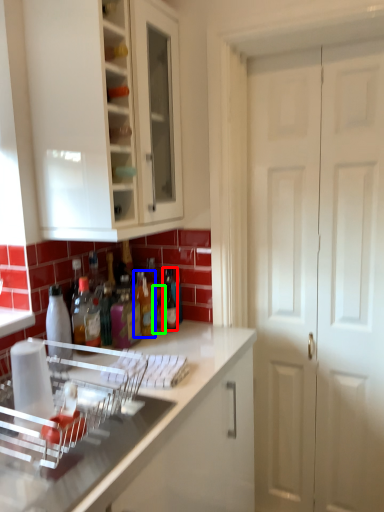
Question: Which object is the closest to the bottle (highlighted by a red box)? Choose among these: bottle (highlighted by a blue box) or bottle (highlighted by a green box).

Choices:
 (A) bottle
 (B) bottle

Answer: (B)